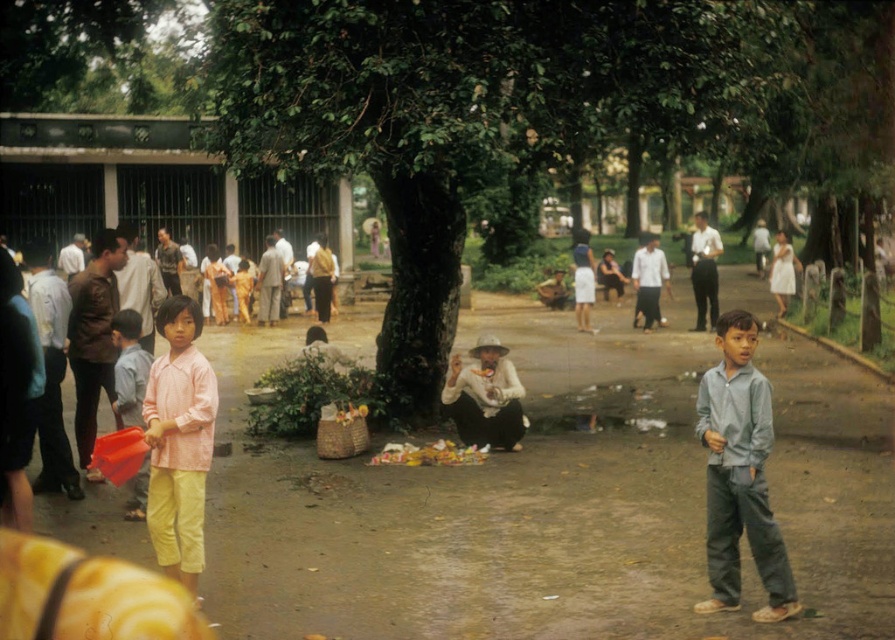
Which is behind, point (350, 28) or point (723, 497)?

Point (350, 28)

Which is more to the left, green leafy tree at center or light blue shirt at center?

light blue shirt at center is more to the left.

Locate an element on the screen. Image resolution: width=895 pixels, height=640 pixels. green leafy tree at center is located at coordinates (465, 116).

Between green leafy tree at center and pink woven shirt at center, which one is positioned lower?

pink woven shirt at center is lower down.

Between green leafy tree at center and pink woven shirt at center, which one appears on the right side from the viewer's perspective?

Positioned to the right is green leafy tree at center.

At what (x,y) coordinates should I click in order to perform the action: click on green leafy tree at center. Please return your answer as a coordinate pair (x, y). This screenshot has height=640, width=895. Looking at the image, I should click on (465, 116).

Does light blue shirt at center have a larger size compared to pink woven shirt at center?

No, light blue shirt at center is not bigger than pink woven shirt at center.

Who is higher up, light blue shirt at center or pink woven shirt at center?

pink woven shirt at center is higher up.

Between point (780, 588) and point (152, 378), which one is positioned behind?

Positioned behind is point (152, 378).

Where is `light blue shirt at center`? This screenshot has width=895, height=640. light blue shirt at center is located at coordinates (739, 474).